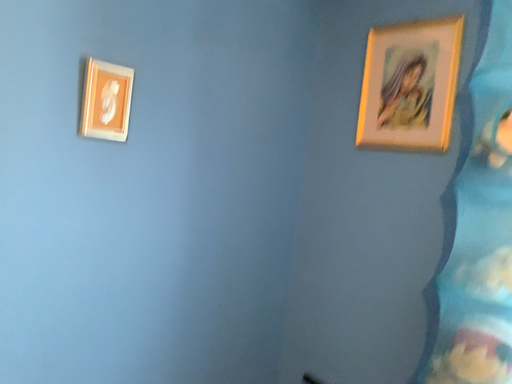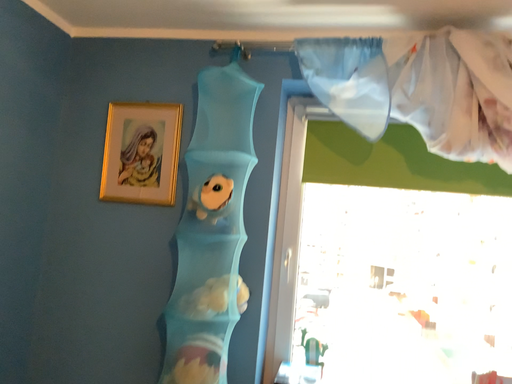
Question: Which way did the camera rotate in the video?

Choices:
 (A) rotated upward
 (B) rotated downward

Answer: (A)